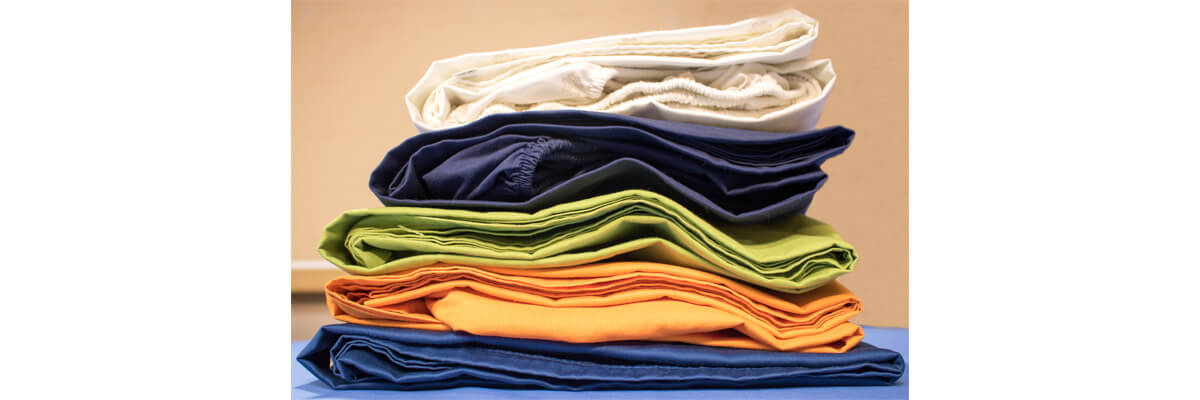
Locate an element on the screen. folded clothes is located at coordinates (469, 367), (508, 317), (517, 244), (538, 175), (534, 99).